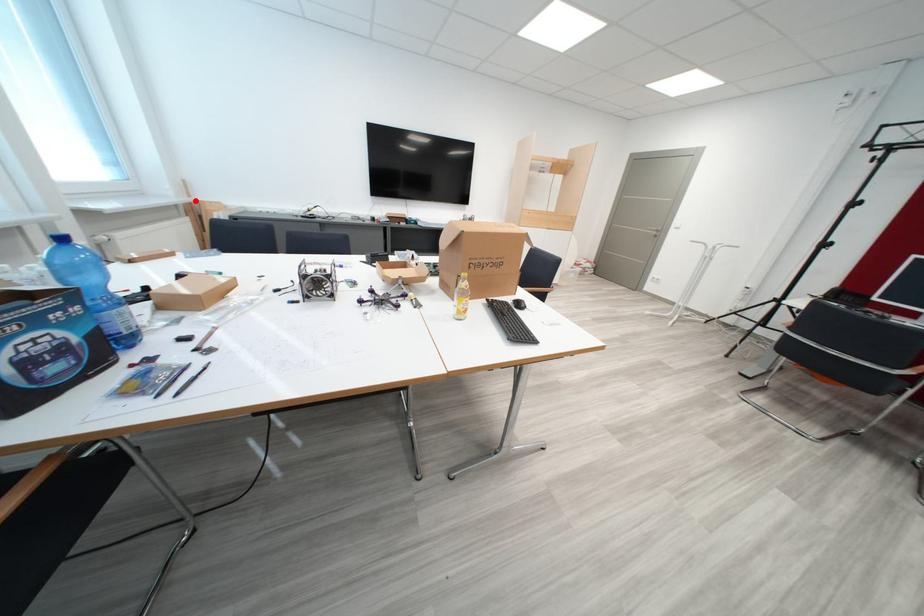
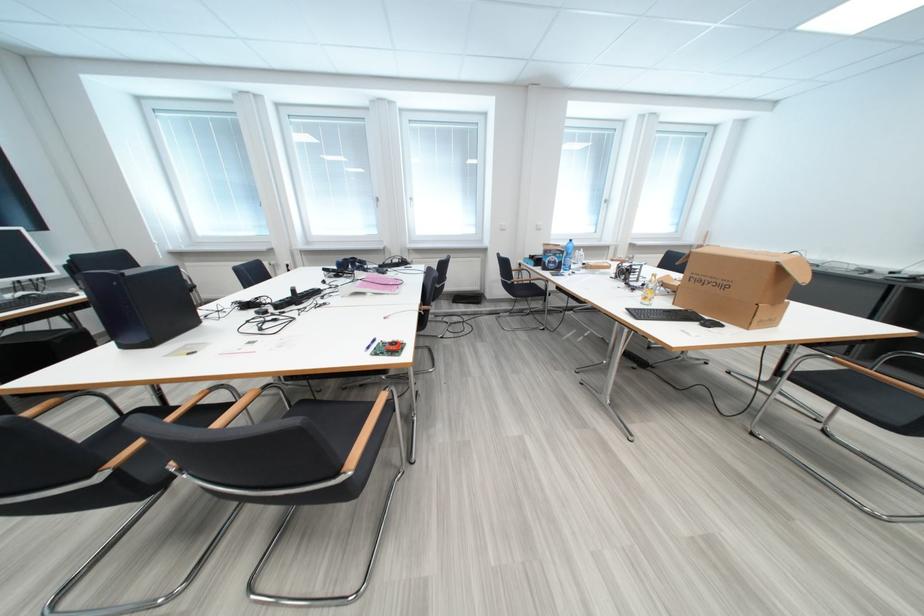
The point at the highlighted location is marked in the first image. Where is the corresponding point in the second image?

(711, 245)